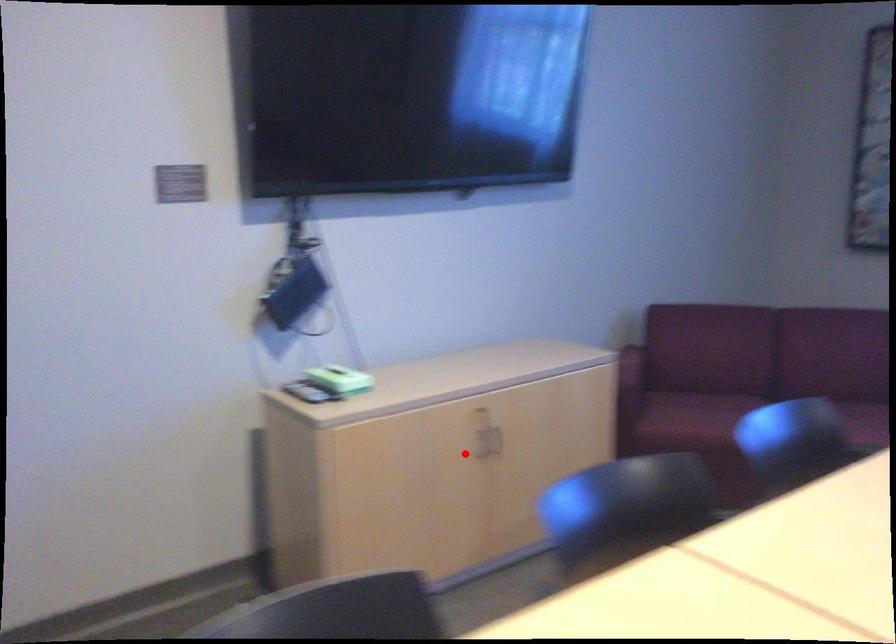
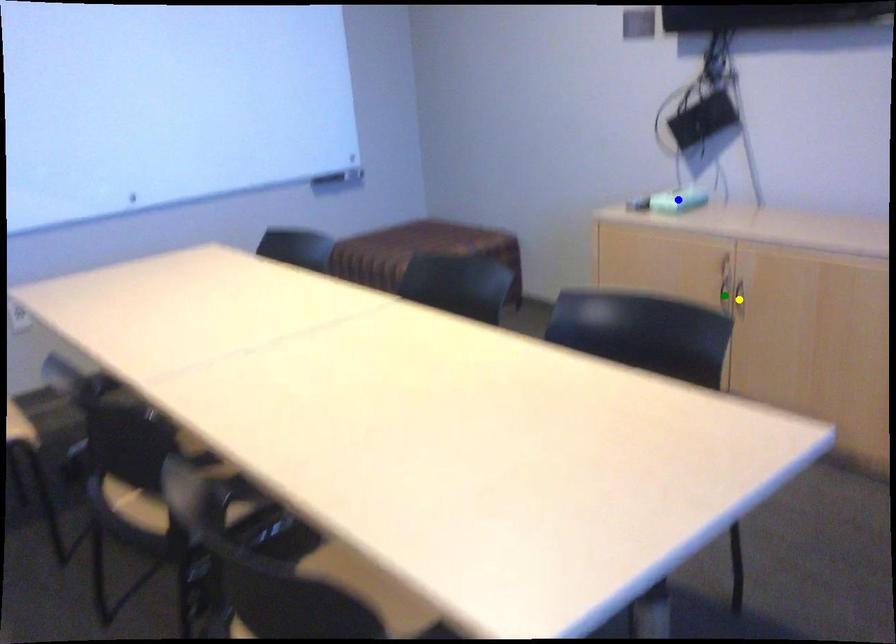
Question: I am providing you with two images of the same scene from different viewpoints. A red point is marked on the first image. You are given multiple points on the second image. Which point in image 2 is actually the same real-world point as the red point in image 1?

Choices:
 (A) yellow point
 (B) blue point
 (C) green point

Answer: (C)